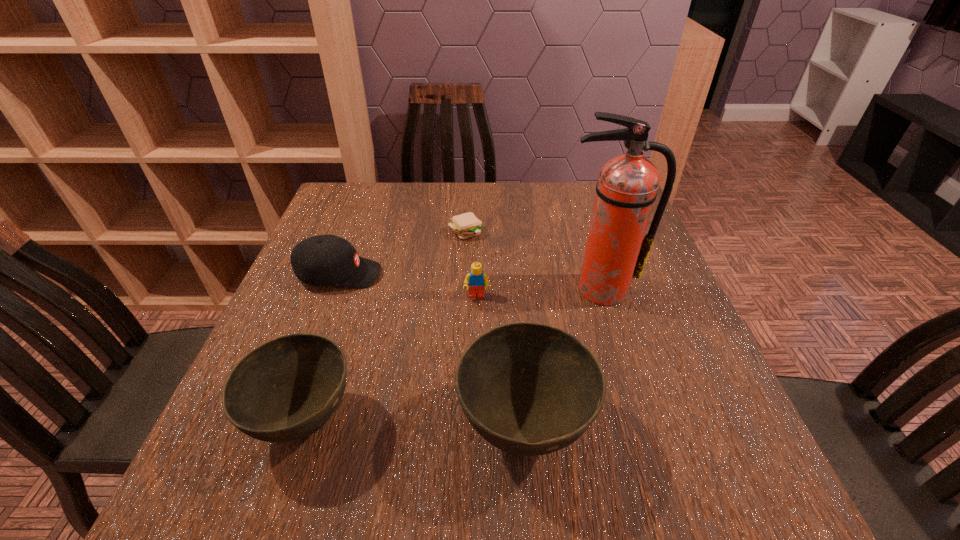
In the image, there is a desktop. In order to click on vacant space at the far edge in this screenshot , I will do `click(409, 183)`.

Identify the location of free space at the left edge of the desktop. The height and width of the screenshot is (540, 960). (326, 318).

The height and width of the screenshot is (540, 960). What are the coordinates of `vacant space at the right edge` in the screenshot? It's located at (647, 321).

The width and height of the screenshot is (960, 540). Find the location of `vacant position at the far left corner of the desktop`. vacant position at the far left corner of the desktop is located at coordinates [379, 206].

The image size is (960, 540). In the image, there is a desktop. Find the location of `free region at the far right corner`. free region at the far right corner is located at coordinates (591, 200).

Locate an element on the screen. unoccupied position between the farthest object and the left bowl is located at coordinates (386, 326).

Locate an element on the screen. The image size is (960, 540). vacant space that is in between the right bowl and the shorter bowl is located at coordinates (415, 425).

The image size is (960, 540). I want to click on free spot between the baseball cap and the Lego, so click(x=408, y=285).

Identify the location of empty location between the shortest object and the left bowl. The image size is (960, 540). (386, 326).

At what (x,y) coordinates should I click in order to perform the action: click on unoccupied position between the shortest object and the Lego. Please return your answer as a coordinate pair (x, y). Looking at the image, I should click on (471, 264).